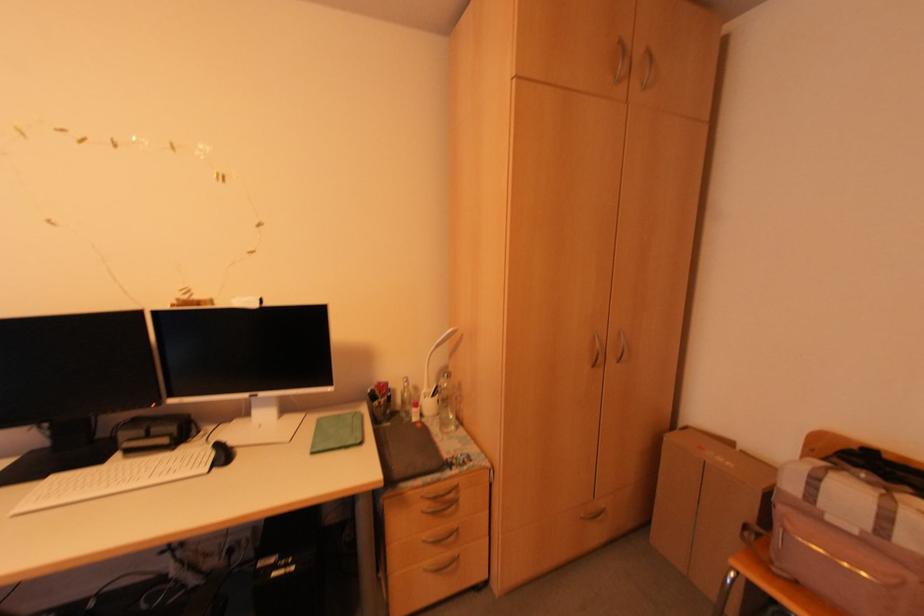
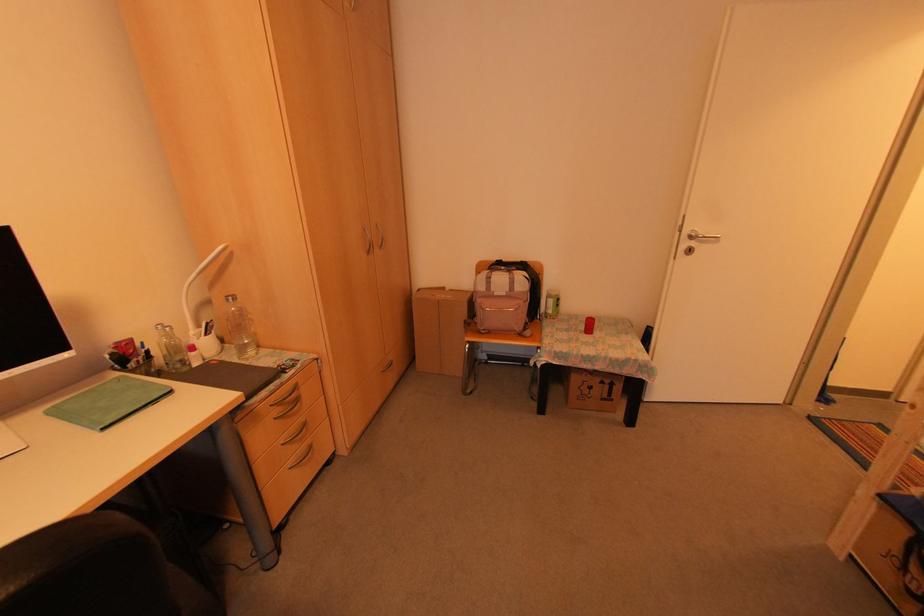
The point at (455,488) is marked in the first image. Where is the corresponding point in the second image?

(294, 387)